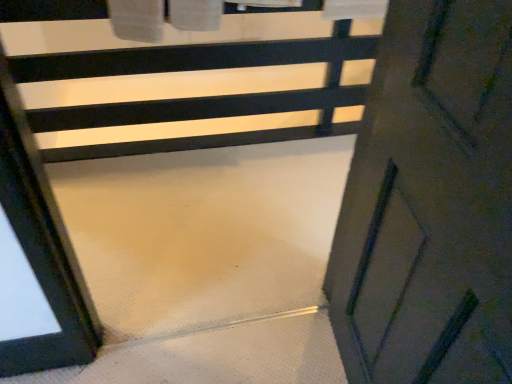
Find the location of `vacant space situated on the left part of white matte stair at center`. vacant space situated on the left part of white matte stair at center is located at coordinates (133, 271).